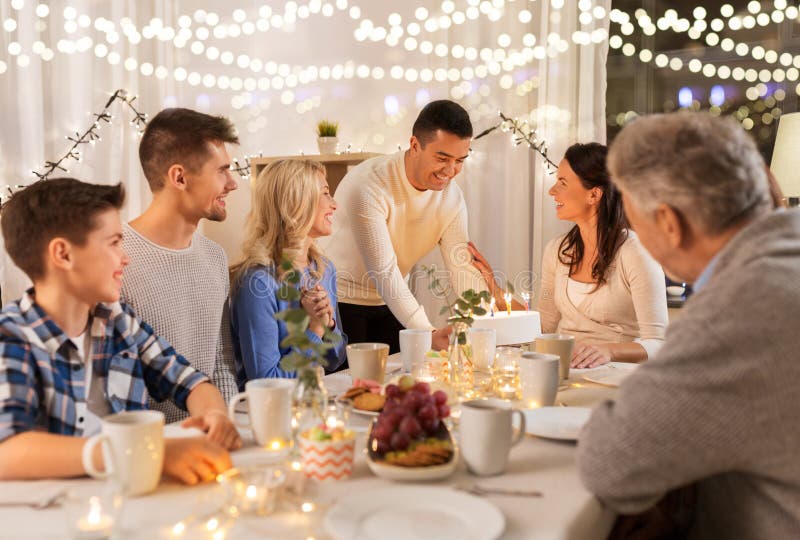
Where is `cups`? The height and width of the screenshot is (540, 800). cups is located at coordinates (157, 474), (258, 421), (348, 370), (401, 351), (474, 330), (556, 347), (545, 380), (496, 427).